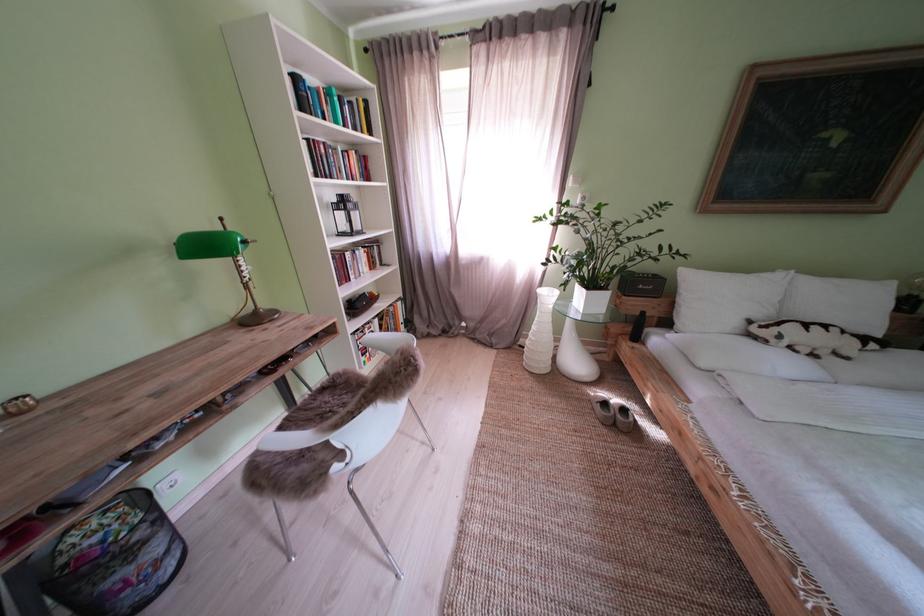
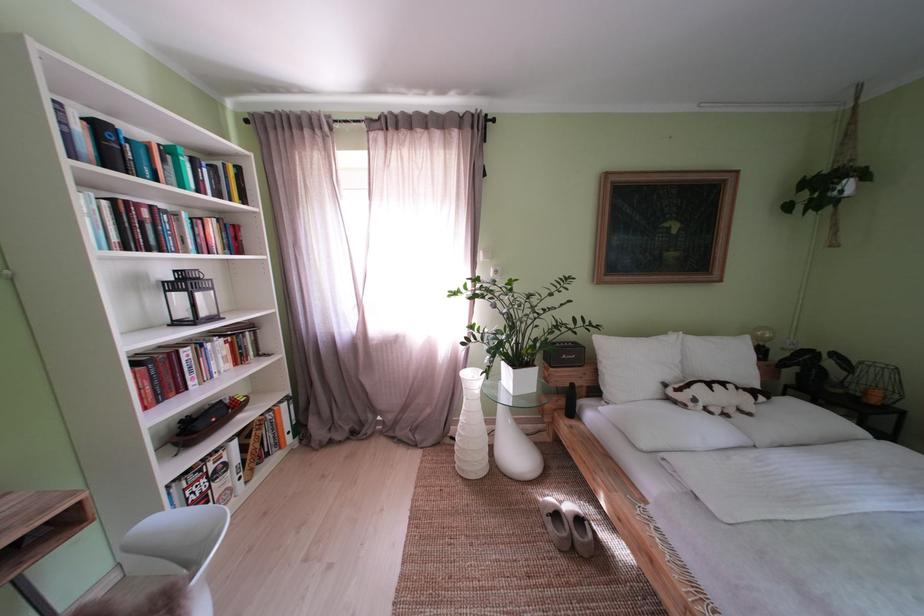
In the second image, find the point that corresponds to pixel 723 304 in the first image.

(639, 369)